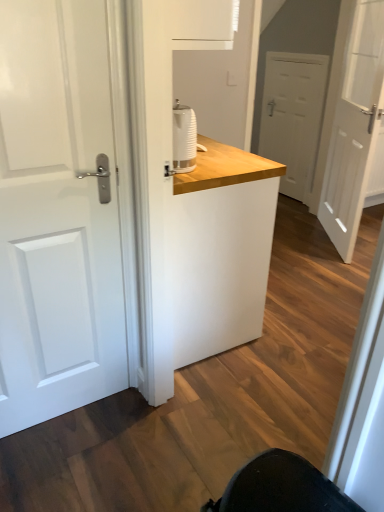
Question: Considering the relative positions of white matte door at right, which ranks as the 2th door in back-to-front order, and white wood counter at center in the image provided, is white matte door at right, which ranks as the 2th door in back-to-front order, behind white wood counter at center?

Choices:
 (A) yes
 (B) no

Answer: (A)

Question: Is white matte door at right, arranged as the first door when viewed from the right, not inside white wood counter at center?

Choices:
 (A) yes
 (B) no

Answer: (A)

Question: From a real-world perspective, is white matte door at right, the second door viewed from the front, on white wood counter at center?

Choices:
 (A) yes
 (B) no

Answer: (A)

Question: Is white matte door at right, acting as the 3th door starting from the left, to the right of white wood counter at center from the viewer's perspective?

Choices:
 (A) yes
 (B) no

Answer: (A)

Question: Is white wood counter at center completely or partially inside white matte door at right, the second door viewed from the front?

Choices:
 (A) yes
 (B) no

Answer: (B)

Question: Is white matte door at right, which ranks as the 2th door in back-to-front order, positioned far away from white wood counter at center?

Choices:
 (A) yes
 (B) no

Answer: (A)

Question: Is white glossy door at left, which is the 1th door from front to back, outside white matte door at center, which is the 2th door from right to left?

Choices:
 (A) no
 (B) yes

Answer: (B)

Question: Is white glossy door at left, which is the 1th door from front to back, positioned in front of white matte door at center, the 3th door positioned from the front?

Choices:
 (A) yes
 (B) no

Answer: (A)

Question: Is white glossy door at left, which is the 1th door in left-to-right order, facing towards white matte door at center, the first door from the back?

Choices:
 (A) yes
 (B) no

Answer: (B)

Question: From a real-world perspective, is white glossy door at left, which is the 1th door from front to back, positioned under white matte door at center, the 3th door positioned from the front, based on gravity?

Choices:
 (A) no
 (B) yes

Answer: (A)

Question: Does white glossy door at left, which is the 1th door from front to back, come behind white matte door at center, the 2th door in the left-to-right sequence?

Choices:
 (A) no
 (B) yes

Answer: (A)

Question: Is white glossy door at left, which is the 1th door in left-to-right order, facing away from white matte door at center, which is the 2th door from right to left?

Choices:
 (A) no
 (B) yes

Answer: (A)

Question: Is white matte door at center, the first door from the back, wider than white matte door at right, arranged as the first door when viewed from the right?

Choices:
 (A) no
 (B) yes

Answer: (A)